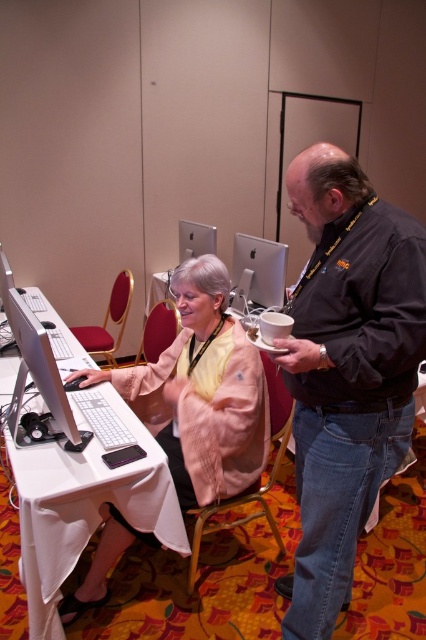
Question: Is matte pink jacket at center to the left of pink fabric jacket at lower left from the viewer's perspective?

Choices:
 (A) yes
 (B) no

Answer: (B)

Question: Which is nearer to the satin silver monitor at center?

Choices:
 (A) dark gray shirt at center
 (B) white glossy monitor at center
 (C) pink fabric jacket at lower left

Answer: (C)

Question: Which object appears closest to the camera in this image?

Choices:
 (A) white glossy monitor at center
 (B) satin silver monitor at center
 (C) matte pink jacket at center

Answer: (C)

Question: Can you confirm if matte pink jacket at center is bigger than dark gray shirt at center?

Choices:
 (A) yes
 (B) no

Answer: (A)

Question: Where is dark gray shirt at center located in relation to satin silver monitor at center in the image?

Choices:
 (A) above
 (B) below

Answer: (B)

Question: Which object is closer to the camera taking this photo?

Choices:
 (A) satin silver monitor at center
 (B) white glossy monitor at center

Answer: (B)